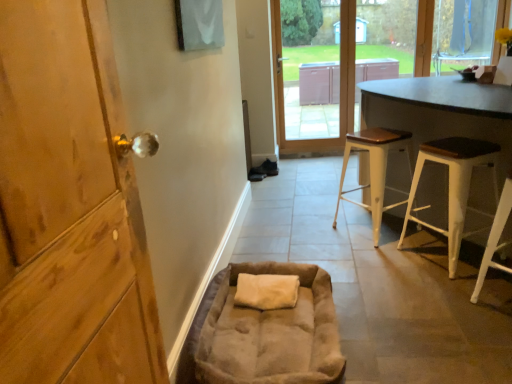
At what (x,y) coordinates should I click in order to perform the action: click on white wood stool at center, the third stool in the front-to-back sequence. Please return your answer as a coordinate pair (x, y). The height and width of the screenshot is (384, 512). Looking at the image, I should click on (374, 168).

In order to face white wood stool at center, positioned as the 1th stool in back-to-front order, should I rotate leftwards or rightwards?

It's best to rotate right around 16.184 degrees.

You are a GUI agent. You are given a task and a screenshot of the screen. Output one action in this format:
    pyautogui.click(x=<x>, y=<y>)
    Task: Click on the matte gray table at upper right
    The width and height of the screenshot is (512, 384).
    Given the screenshot: What is the action you would take?
    pyautogui.click(x=318, y=71)

Locate an element on the screen. This screenshot has height=384, width=512. dark brown wood table at right is located at coordinates (442, 111).

This screenshot has width=512, height=384. What do you see at coordinates (442, 111) in the screenshot?
I see `dark brown wood table at right` at bounding box center [442, 111].

The width and height of the screenshot is (512, 384). What are the coordinates of `suede-like beige bean bag chair at lower center` in the screenshot? It's located at (266, 332).

Identify the location of white wood stool at right, which is counted as the 2th stool, starting from the back. This screenshot has height=384, width=512. (453, 186).

Locate an element on the screen. This screenshot has height=384, width=512. white wood stool at center, the third stool in the front-to-back sequence is located at coordinates (374, 168).

Based on the photo, from the image's perspective, is wooden door at left on suede-like beige bean bag chair at lower center?

Yes, from the image's perspective, wooden door at left is over suede-like beige bean bag chair at lower center.

Does wooden door at left turn towards suede-like beige bean bag chair at lower center?

No, wooden door at left does not turn towards suede-like beige bean bag chair at lower center.

Between wooden door at left and suede-like beige bean bag chair at lower center, which one has larger width?

suede-like beige bean bag chair at lower center.

From a real-world perspective, is wooden door at left above or below suede-like beige bean bag chair at lower center?

Clearly, from a real-world perspective, wooden door at left is above suede-like beige bean bag chair at lower center.

From the image's perspective, which object appears higher, wooden door at left or white wood stool at center, the third stool in the front-to-back sequence?

white wood stool at center, the third stool in the front-to-back sequence, appears higher in the image.

How many degrees apart are the facing directions of wooden door at left and white wood stool at center, the third stool in the front-to-back sequence?

37.1 degrees.

Is wooden door at left not near white wood stool at center, positioned as the 1th stool in back-to-front order?

Yes.

Who is bigger, wooden door at left or white wood stool at center, positioned as the 1th stool in back-to-front order?

white wood stool at center, positioned as the 1th stool in back-to-front order, is bigger.

Who is more distant, white wood stool at lower right, the first stool in the front-to-back sequence, or matte gray table at upper right?

Positioned behind is matte gray table at upper right.

In the scene shown: From a real-world perspective, is white wood stool at lower right, which ranks as the 3th stool in back-to-front order, under matte gray table at upper right?

Correct, in the physical world, white wood stool at lower right, which ranks as the 3th stool in back-to-front order, is lower than matte gray table at upper right.

The width and height of the screenshot is (512, 384). I want to click on the 3rd stool in front of the matte gray table at upper right, starting your count from the anchor, so click(495, 238).

Would you say white wood stool at lower right, which ranks as the 3th stool in back-to-front order, is inside or outside matte gray table at upper right?

The correct answer is: outside.

Is white wood stool at lower right, which ranks as the 3th stool in back-to-front order, at the back of matte gray table at upper right?

No, matte gray table at upper right is not facing the opposite direction of white wood stool at lower right, which ranks as the 3th stool in back-to-front order.

How different are the orientations of matte gray table at upper right and white wood stool at lower right, which ranks as the 3th stool in back-to-front order, in degrees?

There is a 128-degree angle between the facing directions of matte gray table at upper right and white wood stool at lower right, which ranks as the 3th stool in back-to-front order.

Is point (287, 108) positioned before point (509, 196)?

No, it is not.

Which object is positioned more to the left, matte gray table at upper right or white wood stool at lower right, which ranks as the 3th stool in back-to-front order?

white wood stool at lower right, which ranks as the 3th stool in back-to-front order.

Which is more to the right, white wood stool at center, the third stool in the front-to-back sequence, or dark brown wood table at right?

dark brown wood table at right is more to the right.

Is white wood stool at center, positioned as the 1th stool in back-to-front order, looking in the opposite direction of dark brown wood table at right?

Yes.

Is point (389, 142) closer or farther from the camera than point (439, 165)?

Point (389, 142).

Can you confirm if white wood stool at center, the third stool in the front-to-back sequence, is thinner than dark brown wood table at right?

Yes.

Which of these two, suede-like beige bean bag chair at lower center or dark brown wood table at right, stands taller?

With more height is dark brown wood table at right.

From the image's perspective, would you say suede-like beige bean bag chair at lower center is positioned over dark brown wood table at right?

No.

How distant is suede-like beige bean bag chair at lower center from dark brown wood table at right?

They are 1.23 meters apart.

Considering the relative sizes of transparent glass window at upper right and suede-like beige bean bag chair at lower center in the image provided, is transparent glass window at upper right wider than suede-like beige bean bag chair at lower center?

In fact, transparent glass window at upper right might be narrower than suede-like beige bean bag chair at lower center.

This screenshot has width=512, height=384. Identify the location of bean bag chair on the left side of transparent glass window at upper right. (266, 332).

From the picture: Are transparent glass window at upper right and suede-like beige bean bag chair at lower center far apart?

Yes, transparent glass window at upper right is far from suede-like beige bean bag chair at lower center.

How many degrees apart are the facing directions of transparent glass window at upper right and suede-like beige bean bag chair at lower center?

87.5 degrees separate the facing orientations of transparent glass window at upper right and suede-like beige bean bag chair at lower center.

Identify the location of bean bag chair to the right of wooden door at left. (266, 332).

You are a GUI agent. You are given a task and a screenshot of the screen. Output one action in this format:
    pyautogui.click(x=<x>, y=<y>)
    Task: Click on the door lying below the white wood stool at center, positioned as the 1th stool in back-to-front order (from the image's perspective)
    
    Given the screenshot: What is the action you would take?
    pyautogui.click(x=70, y=206)

Estimate the real-world distances between objects in this image. Which object is closer to white wood stool at center, the third stool in the front-to-back sequence, white wood stool at right, which is counted as the 2th stool, starting from the back, or wooden door at left?

The object closer to white wood stool at center, the third stool in the front-to-back sequence, is white wood stool at right, which is counted as the 2th stool, starting from the back.

Considering their positions, is white wood stool at lower right, the first stool in the front-to-back sequence, positioned further to white wood stool at center, the third stool in the front-to-back sequence, than wooden door at left?

wooden door at left is further to white wood stool at center, the third stool in the front-to-back sequence.

Considering their positions, is dark brown wood table at right positioned closer to transparent glass window at upper right than wooden door at left?

The object closer to transparent glass window at upper right is dark brown wood table at right.

Based on their spatial positions, is suede-like beige bean bag chair at lower center or transparent glass window at upper right closer to wooden door at left?

Among the two, suede-like beige bean bag chair at lower center is located nearer to wooden door at left.

When comparing their distances from suede-like beige bean bag chair at lower center, does white wood stool at lower right, the first stool in the front-to-back sequence, or white wood stool at right, placed as the 2th stool when sorted from front to back, seem further?

white wood stool at right, placed as the 2th stool when sorted from front to back, is positioned further to the anchor suede-like beige bean bag chair at lower center.

Looking at the image, which one is located further to wooden door at left, suede-like beige bean bag chair at lower center or white wood stool at center, positioned as the 1th stool in back-to-front order?

white wood stool at center, positioned as the 1th stool in back-to-front order, is positioned further to the anchor wooden door at left.

When comparing their distances from white wood stool at lower right, the first stool in the front-to-back sequence, does white wood stool at center, the third stool in the front-to-back sequence, or suede-like beige bean bag chair at lower center seem closer?

white wood stool at center, the third stool in the front-to-back sequence, is positioned closer to the anchor white wood stool at lower right, the first stool in the front-to-back sequence.

From the image, which object appears to be farther from suede-like beige bean bag chair at lower center, wooden door at left or white wood stool at lower right, which ranks as the 3th stool in back-to-front order?

Among the two, white wood stool at lower right, which ranks as the 3th stool in back-to-front order, is located further to suede-like beige bean bag chair at lower center.

Locate an element on the screen. This screenshot has width=512, height=384. bean bag chair between wooden door at left and white wood stool at lower right, which ranks as the 3th stool in back-to-front order is located at coordinates (266, 332).

Locate an element on the screen. This screenshot has height=384, width=512. bean bag chair between wooden door at left and transparent glass window at upper right from front to back is located at coordinates (266, 332).

This screenshot has height=384, width=512. What are the coordinates of `screen door between white wood stool at right, which is counted as the 2th stool, starting from the back, and transparent glass window at upper right in the front-back direction` in the screenshot? It's located at (318, 71).

Find the location of a particular element. Image resolution: width=512 pixels, height=384 pixels. screen door between wooden door at left and transparent glass window at upper right along the z-axis is located at coordinates (318, 71).